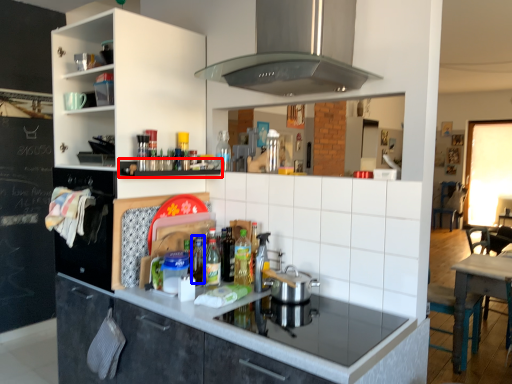
Question: Which point is closer to the camera, shelf (highlighted by a red box) or bottle (highlighted by a blue box)?

Choices:
 (A) shelf
 (B) bottle

Answer: (A)